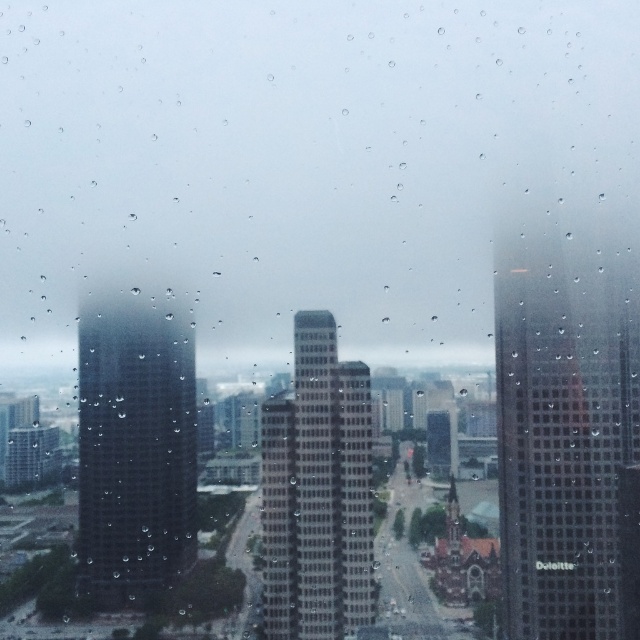
Is point (182, 340) behind point (316, 582)?

Yes, point (182, 340) is farther from viewer.

Is point (120, 435) positioned in front of point (307, 461)?

No, (120, 435) is behind (307, 461).

This screenshot has height=640, width=640. I want to click on matte glass skyscraper at left, so click(134, 452).

Does matte glass skyscraper at right appear on the left side of matte glass skyscraper at left?

Incorrect, matte glass skyscraper at right is not on the left side of matte glass skyscraper at left.

Is point (518, 598) behind point (122, 444)?

Yes, it is behind point (122, 444).

Is point (596, 342) farther from camera compared to point (125, 412)?

Yes, it is behind point (125, 412).

The image size is (640, 640). In order to click on matte glass skyscraper at right in this screenshot , I will do `click(564, 412)`.

Where is `matte glass skyscraper at right`? Image resolution: width=640 pixels, height=640 pixels. matte glass skyscraper at right is located at coordinates (564, 412).

Between matte glass skyscraper at right and gray concrete skyscraper at center, which one appears on the right side from the viewer's perspective?

matte glass skyscraper at right is more to the right.

Is point (515, 413) positioned behind point (323, 435)?

Yes.

At what (x,y) coordinates should I click in order to perform the action: click on matte glass skyscraper at right. Please return your answer as a coordinate pair (x, y). Looking at the image, I should click on (564, 412).